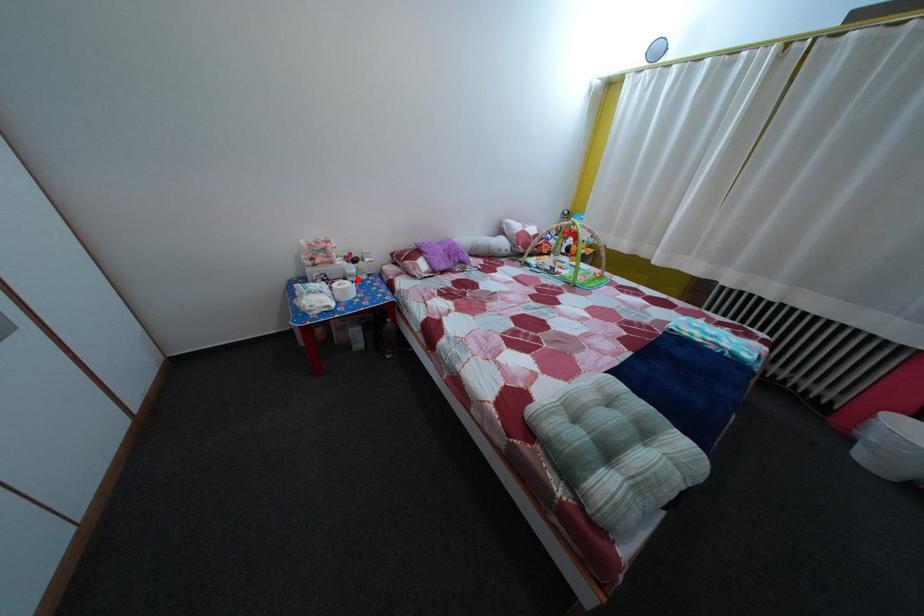
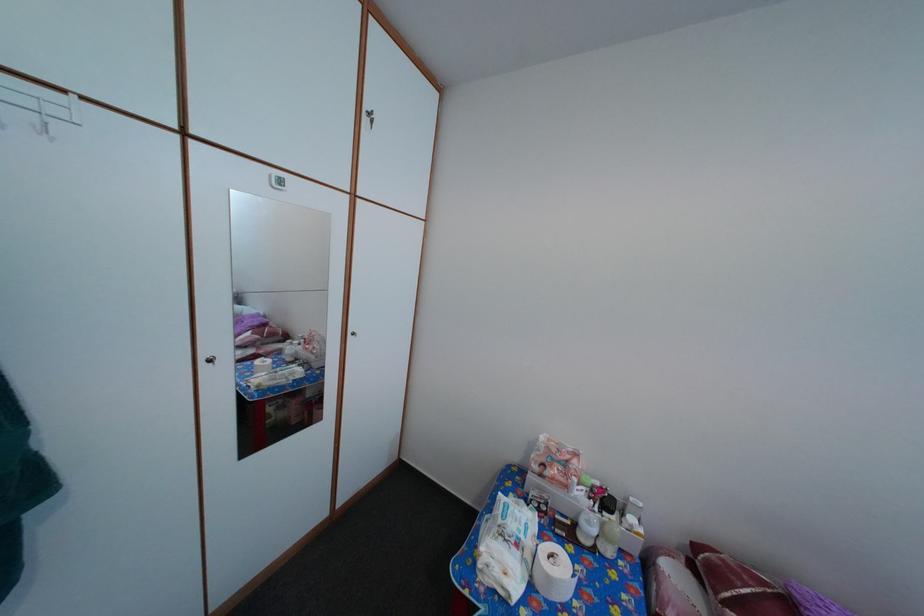
In the second image, find the point that corresponds to the highlighted location in the first image.

(592, 531)